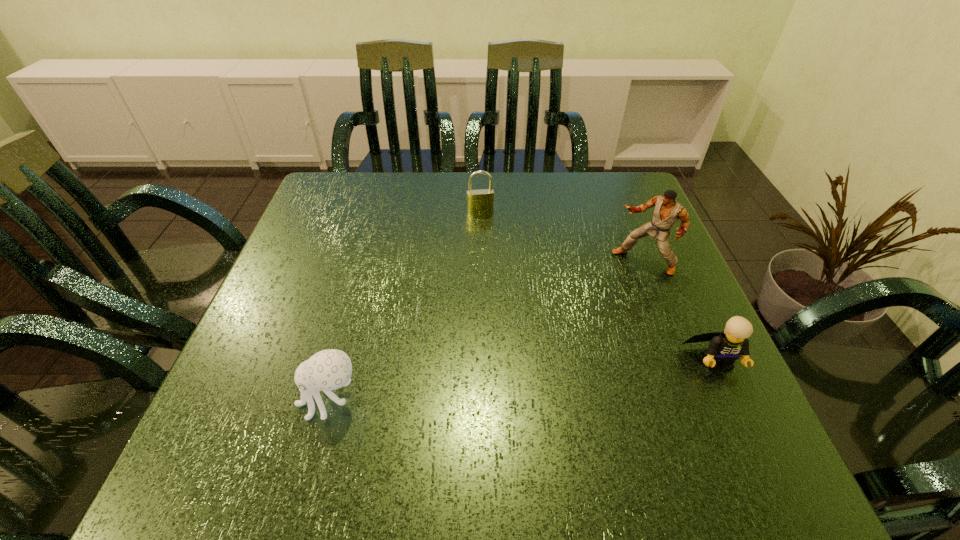
The image size is (960, 540). I want to click on free spot on the desktop that is between the octopus and the Lego and is positioned on the front-facing side of the padlock, so click(506, 381).

I want to click on free space on the desktop that is between the leftmost object and the Lego and is positioned on the front-facing side of the puncher, so click(515, 381).